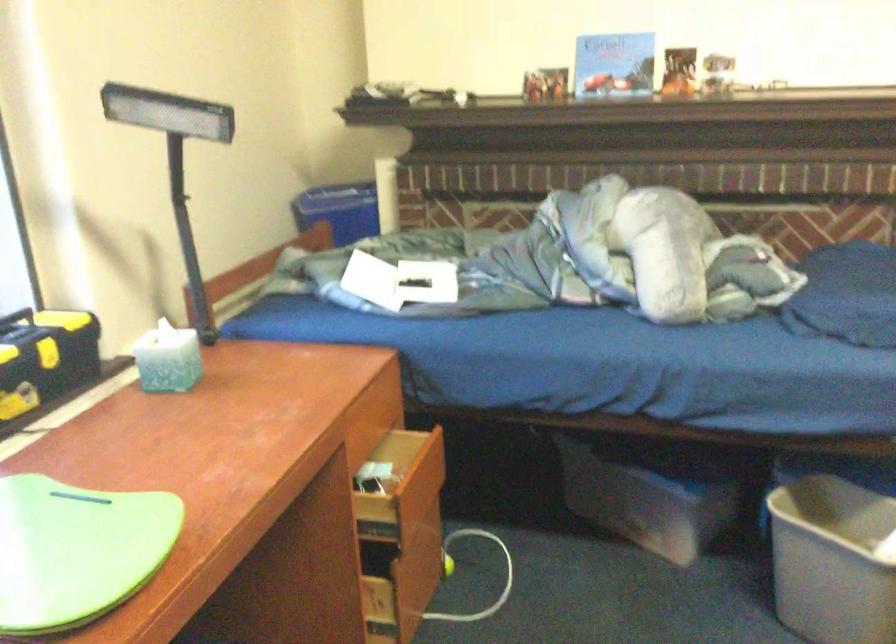
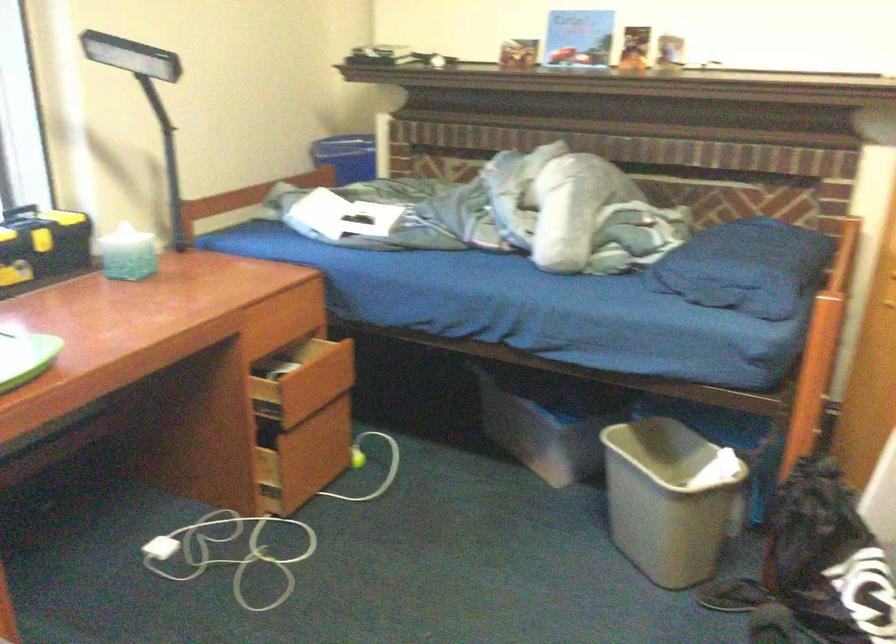
Question: The camera is either moving clockwise (left) or counter-clockwise (right) around the object. The first image is from the beginning of the video and the second image is from the end. Is the camera moving left or right when shooting the video?

Choices:
 (A) Left
 (B) Right

Answer: (B)